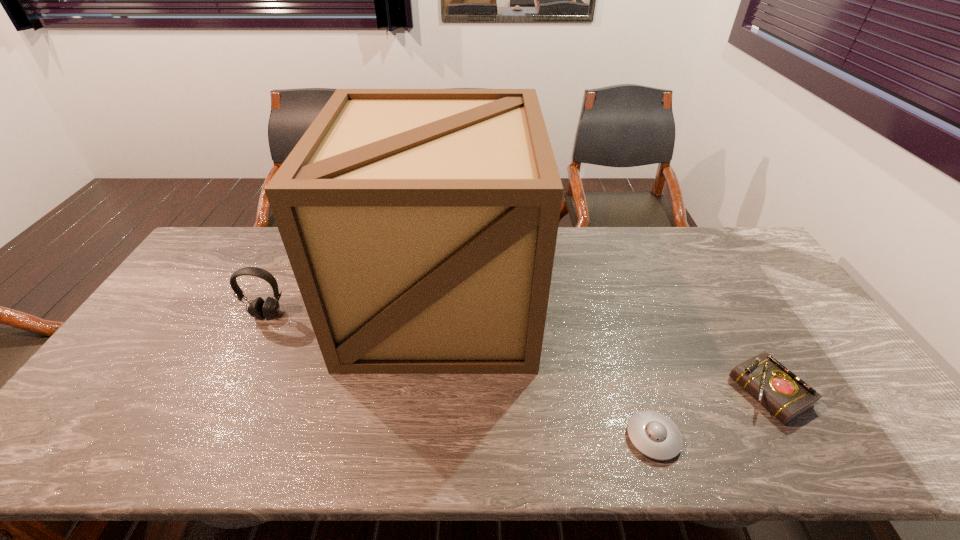
This screenshot has width=960, height=540. In order to click on free space at the far left corner of the desktop in this screenshot , I will do `click(217, 232)`.

At what (x,y) coordinates should I click in order to perform the action: click on vacant space at the far right corner of the desktop. Please return your answer as a coordinate pair (x, y). Image resolution: width=960 pixels, height=540 pixels. Looking at the image, I should click on (742, 241).

Image resolution: width=960 pixels, height=540 pixels. Find the location of `free space between the saucer and the rightmost object`. free space between the saucer and the rightmost object is located at coordinates (711, 415).

This screenshot has width=960, height=540. Identify the location of free point between the headset and the second object from right to left. (460, 376).

This screenshot has height=540, width=960. I want to click on vacant space that is in between the diary and the tallest object, so click(x=605, y=347).

This screenshot has width=960, height=540. I want to click on free spot between the rightmost object and the tallest object, so click(605, 347).

This screenshot has height=540, width=960. Identify the location of empty space between the leftmost object and the third object from left to right. (460, 376).

What are the coordinates of `vacant area that lies between the second tallest object and the shortest object` in the screenshot? It's located at (460, 376).

The width and height of the screenshot is (960, 540). Identify the location of object that stands as the closest to the box. (258, 308).

Locate an element on the screen. The height and width of the screenshot is (540, 960). object that stands as the third closest to the third object from left to right is located at coordinates (258, 308).